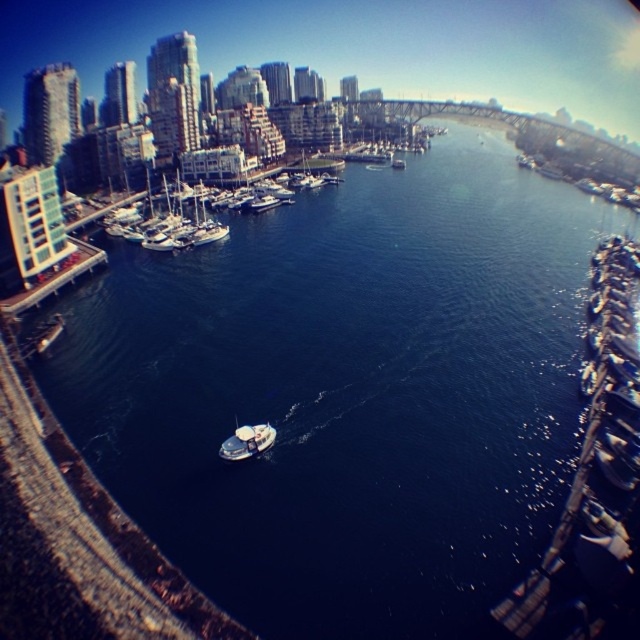
Question: Is smooth concrete dock at left bigger than shiny silver boat at center?

Choices:
 (A) no
 (B) yes

Answer: (B)

Question: Does smooth concrete dock at left come in front of white matte boat at center-left?

Choices:
 (A) yes
 (B) no

Answer: (A)

Question: Which object is positioned farthest from the white matte boat at center-left?

Choices:
 (A) smooth concrete dock at left
 (B) white matte boats at center

Answer: (B)

Question: Which point is closer to the camera?

Choices:
 (A) (266, 435)
 (B) (157, 230)
 (C) (92, 272)

Answer: (A)

Question: Does smooth concrete dock at left come behind shiny silver boat at center?

Choices:
 (A) yes
 (B) no

Answer: (A)

Question: Among these objects, which one is nearest to the camera?

Choices:
 (A) white matte boats at center
 (B) smooth concrete dock at left
 (C) white matte boat at center-left

Answer: (B)